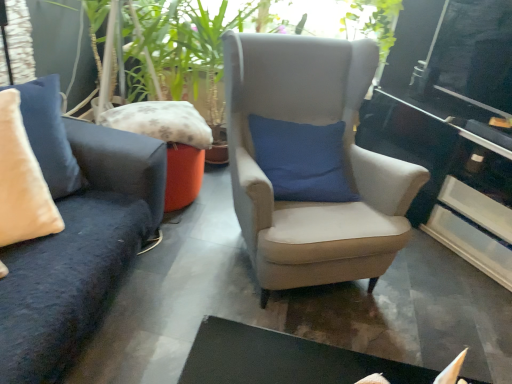
Question: From the image's perspective, is fluffy fabric pillow at center, positioned as the first pillow in back-to-front order, located beneath suede beige armchair at center?

Choices:
 (A) yes
 (B) no

Answer: (B)

Question: Could suede beige armchair at center be considered to be inside fluffy fabric pillow at center, positioned as the first pillow in back-to-front order?

Choices:
 (A) no
 (B) yes

Answer: (A)

Question: From the image's perspective, is fluffy fabric pillow at center, placed as the second pillow when sorted from front to back, on suede beige armchair at center?

Choices:
 (A) yes
 (B) no

Answer: (A)

Question: Considering the relative sizes of fluffy fabric pillow at center, placed as the second pillow when sorted from front to back, and suede beige armchair at center in the image provided, is fluffy fabric pillow at center, placed as the second pillow when sorted from front to back, wider than suede beige armchair at center?

Choices:
 (A) yes
 (B) no

Answer: (B)

Question: Is fluffy fabric pillow at center, placed as the second pillow when sorted from front to back, to the right of suede beige armchair at center from the viewer's perspective?

Choices:
 (A) no
 (B) yes

Answer: (A)

Question: Relative to beige velvet pillow at left, acting as the 2th pillow starting from the back, is glossy black table at right in front or behind?

Choices:
 (A) behind
 (B) front

Answer: (A)

Question: In terms of height, does glossy black table at right look taller or shorter compared to beige velvet pillow at left, the 1th pillow from the front?

Choices:
 (A) short
 (B) tall

Answer: (B)

Question: From a real-world perspective, relative to beige velvet pillow at left, the 1th pillow from the front, is glossy black table at right vertically above or below?

Choices:
 (A) below
 (B) above

Answer: (A)

Question: Based on their sizes in the image, would you say glossy black table at right is bigger or smaller than beige velvet pillow at left, the 1th pillow from the front?

Choices:
 (A) big
 (B) small

Answer: (A)

Question: Is fluffy fabric pillow at center, positioned as the first pillow in back-to-front order, taller or shorter than glossy black table at right?

Choices:
 (A) short
 (B) tall

Answer: (A)

Question: Considering their positions, is fluffy fabric pillow at center, placed as the second pillow when sorted from front to back, located in front of or behind glossy black table at right?

Choices:
 (A) front
 (B) behind

Answer: (B)

Question: Does point (122, 130) appear closer or farther from the camera than point (496, 241)?

Choices:
 (A) closer
 (B) farther

Answer: (A)

Question: Based on their sizes in the image, would you say fluffy fabric pillow at center, positioned as the first pillow in back-to-front order, is bigger or smaller than glossy black table at right?

Choices:
 (A) big
 (B) small

Answer: (B)

Question: Looking at their shapes, would you say fluffy fabric pillow at center, placed as the second pillow when sorted from front to back, is wider or thinner than suede beige armchair at center?

Choices:
 (A) thin
 (B) wide

Answer: (A)

Question: Based on their positions, is fluffy fabric pillow at center, positioned as the first pillow in back-to-front order, located to the left or right of suede beige armchair at center?

Choices:
 (A) right
 (B) left

Answer: (B)